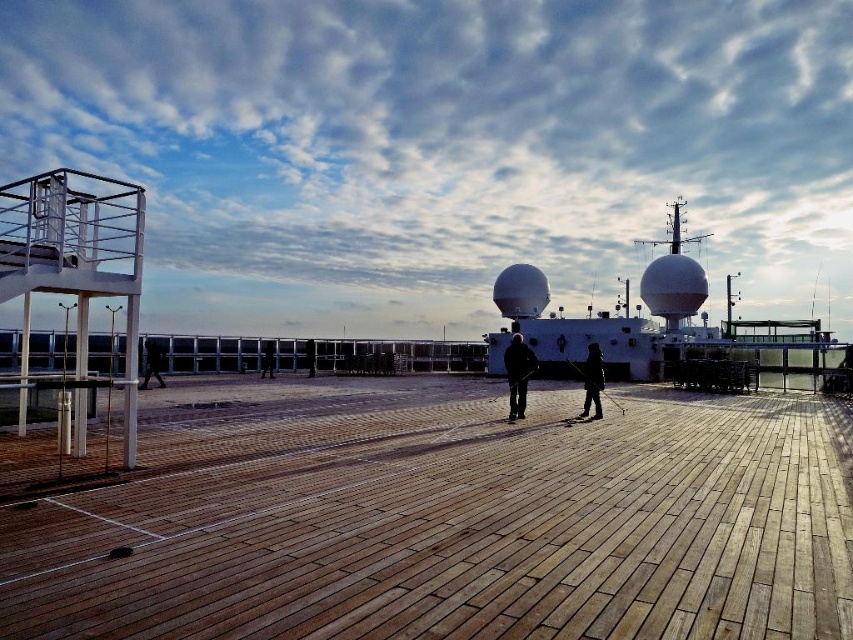
Question: Where is white glossy radar dome at center located in relation to dark gray fabric jacket at center in the image?

Choices:
 (A) below
 (B) above

Answer: (B)

Question: Which is farther from the white glossy radar dome at center?

Choices:
 (A) dark fabric jacket at center
 (B) black leather jacket at left

Answer: (B)

Question: Can you confirm if white glossy radar dome at center is positioned to the left of dark fabric jacket at center?

Choices:
 (A) yes
 (B) no

Answer: (B)

Question: Can you confirm if white glossy radar dome at center is smaller than black leather jacket at left?

Choices:
 (A) yes
 (B) no

Answer: (B)

Question: Which object is closer to the camera taking this photo?

Choices:
 (A) white glossy radar dome at center
 (B) dark fabric jacket at center
 (C) wooden at center
 (D) black fabric person at center

Answer: (C)

Question: Which of the following is the closest to the observer?

Choices:
 (A) dark gray fabric jacket at center
 (B) white glossy radar dome at center
 (C) wooden at center

Answer: (C)